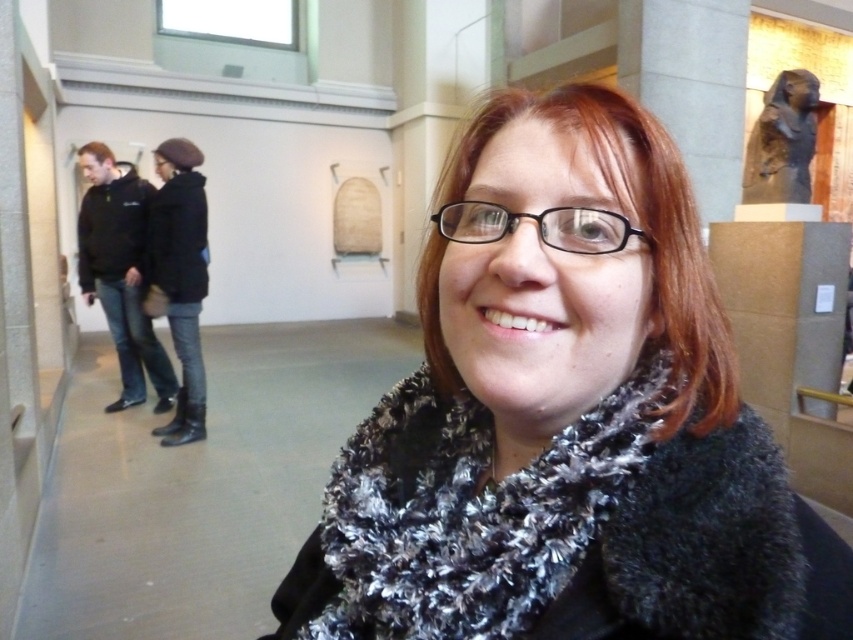
Who is more distant from viewer, (451, 593) or (195, 394)?

The point (195, 394) is more distant.

Can you confirm if black fuzzy scarf at center is wider than black leather boots at lower left?

Indeed, black fuzzy scarf at center has a greater width compared to black leather boots at lower left.

What do you see at coordinates (560, 413) in the screenshot? I see `black fuzzy scarf at center` at bounding box center [560, 413].

The height and width of the screenshot is (640, 853). Find the location of `black fuzzy scarf at center`. black fuzzy scarf at center is located at coordinates (560, 413).

How distant is fuzzy black-and-white scarf at center from black leather boots at lower left?

A distance of 10.94 feet exists between fuzzy black-and-white scarf at center and black leather boots at lower left.

Measure the distance between fuzzy black-and-white scarf at center and camera.

The distance of fuzzy black-and-white scarf at center from camera is 15.24 inches.

Is point (587, 477) closer to viewer compared to point (184, 140)?

Yes, it is in front of point (184, 140).

At what (x,y) coordinates should I click in order to perform the action: click on fuzzy black-and-white scarf at center. Please return your answer as a coordinate pair (x, y). Looking at the image, I should click on (467, 513).

Describe the element at coordinates (467, 513) in the screenshot. The width and height of the screenshot is (853, 640). I see `fuzzy black-and-white scarf at center` at that location.

Who is positioned more to the left, fuzzy black-and-white scarf at center or black hoodie at left?

black hoodie at left is more to the left.

Identify the location of fuzzy black-and-white scarf at center. (467, 513).